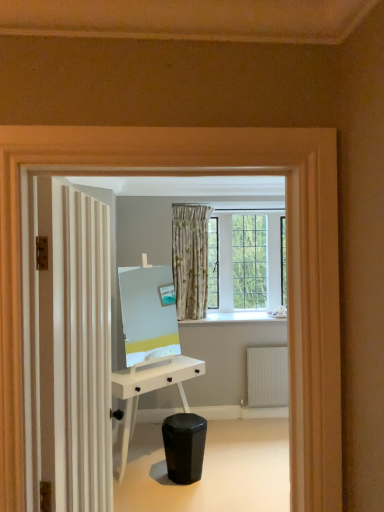
Question: Could you tell me if black matte swivel chair at lower center is facing white matte desk at center?

Choices:
 (A) no
 (B) yes

Answer: (B)

Question: Can you confirm if black matte swivel chair at lower center is shorter than white matte desk at center?

Choices:
 (A) yes
 (B) no

Answer: (A)

Question: Is black matte swivel chair at lower center smaller than white matte desk at center?

Choices:
 (A) yes
 (B) no

Answer: (A)

Question: Are black matte swivel chair at lower center and white matte desk at center located far from each other?

Choices:
 (A) yes
 (B) no

Answer: (B)

Question: Is black matte swivel chair at lower center positioned in front of white matte desk at center?

Choices:
 (A) yes
 (B) no

Answer: (A)

Question: Is point (127, 370) positioned closer to the camera than point (190, 426)?

Choices:
 (A) farther
 (B) closer

Answer: (A)

Question: In the image, is white matte desk at center on the left side or the right side of black matte swivel chair at lower center?

Choices:
 (A) left
 (B) right

Answer: (A)

Question: Is white matte desk at center in front of or behind black matte swivel chair at lower center in the image?

Choices:
 (A) front
 (B) behind

Answer: (B)

Question: In terms of height, does white matte desk at center look taller or shorter compared to black matte swivel chair at lower center?

Choices:
 (A) tall
 (B) short

Answer: (A)

Question: In terms of height, does black matte swivel chair at lower center look taller or shorter compared to white matte desk at center?

Choices:
 (A) short
 (B) tall

Answer: (A)

Question: Based on their sizes in the image, would you say black matte swivel chair at lower center is bigger or smaller than white matte desk at center?

Choices:
 (A) big
 (B) small

Answer: (B)

Question: Relative to white matte desk at center, is black matte swivel chair at lower center in front or behind?

Choices:
 (A) behind
 (B) front

Answer: (B)

Question: From a real-world perspective, is black matte swivel chair at lower center positioned above or below white matte desk at center?

Choices:
 (A) below
 (B) above

Answer: (A)

Question: Is black matte swivel chair at lower center taller or shorter than white ribbed radiator at lower right?

Choices:
 (A) short
 (B) tall

Answer: (A)

Question: From a real-world perspective, relative to white ribbed radiator at lower right, is black matte swivel chair at lower center vertically above or below?

Choices:
 (A) below
 (B) above

Answer: (A)